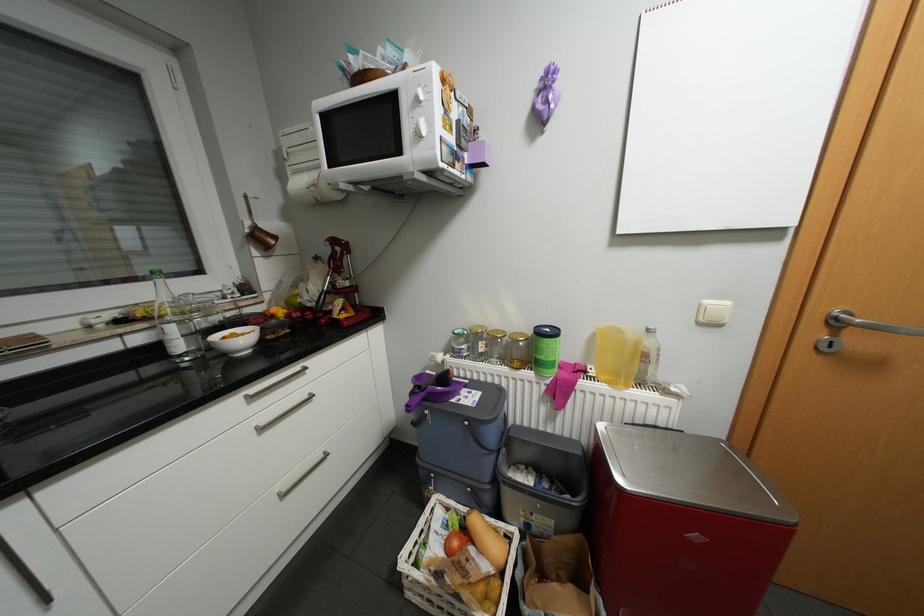
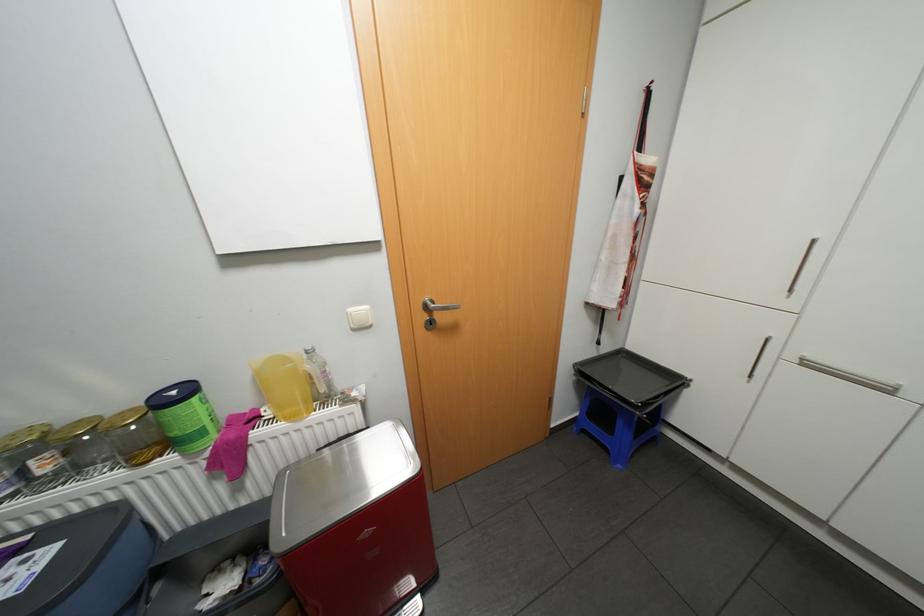
Find the pixel in the second image that matches point 524,331 in the first image.

(128, 411)